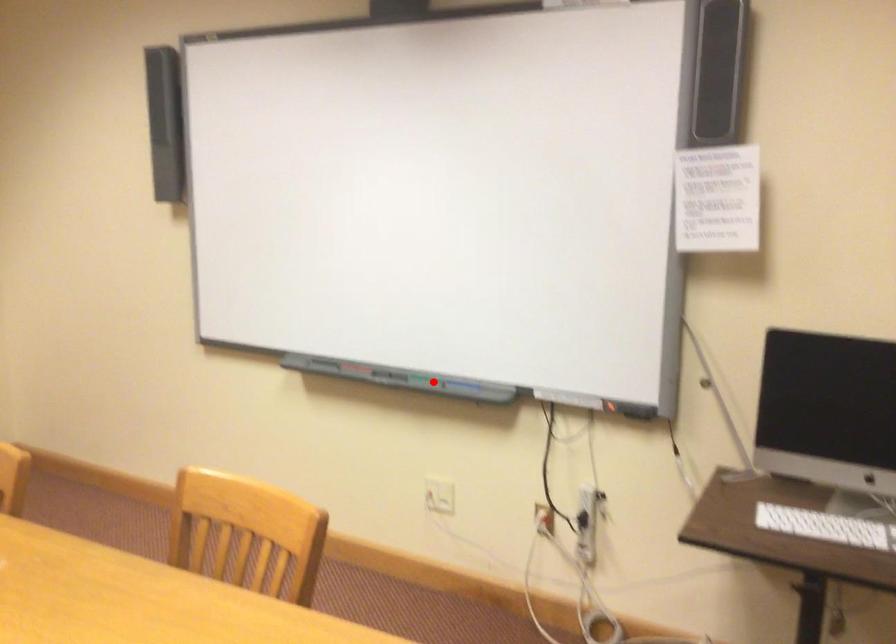
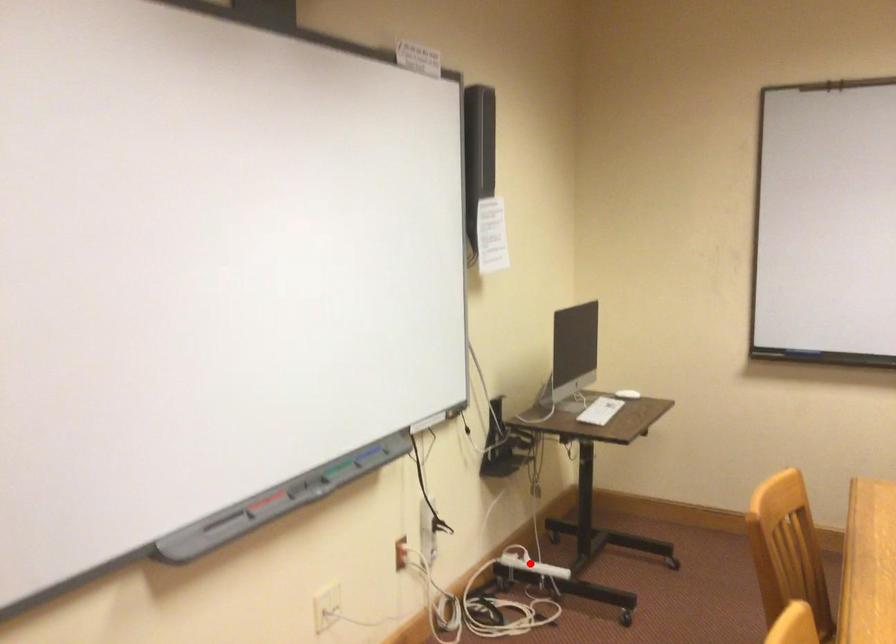
I am providing you with two images of the same scene from different viewpoints. A red point is marked on the first image and another point is marked on the second image. Does the point marked in image1 correspond to the same location as the one in image2?

No